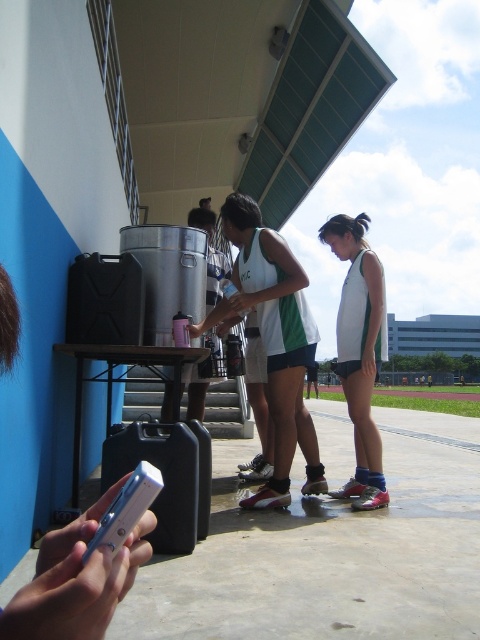
You are a photographer trying to capture a clear shot of the white matte tank top at center and the black plastic suitcase at lower left. Based on their positions, which object should you adjust your camera angle to focus on first to ensure both are in frame?

The white matte tank top at center is positioned on the right side of the black plastic suitcase at lower left. To ensure both are in frame, focus on the black plastic suitcase at lower left first since it is closer to the lower left corner, then adjust to include the white matte tank top at center on the right side.

Based on the coordinates given, what is located at point (x=360, y=352) in the image?

The point (x=360, y=352) marks the location of the white matte tank top at center.

You are standing at the point marked as point [208,518] in the image. You want to take a photo of the teal roof panels and the three athletes near the table. Can you fit both in your camera frame without moving? Please explain using the distance information provided.

The point [208,518] is 3.14 meters away from the viewer. Since the teal roof panels are part of the structure above and the three athletes are in the midground near the table, their positions are likely within the same general area. At 3.14 meters, the camera frame should be able to capture both the roof panels and the athletes as they are relatively close to each other spatially. However, exact framing depends on the camera angle and lens used, but based on distance alone, it is feasible.